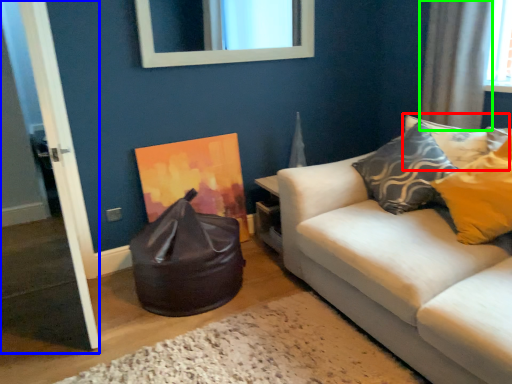
Question: Which is nearer to the pillow (highlighted by a red box)? door (highlighted by a blue box) or curtain (highlighted by a green box).

Choices:
 (A) door
 (B) curtain

Answer: (B)